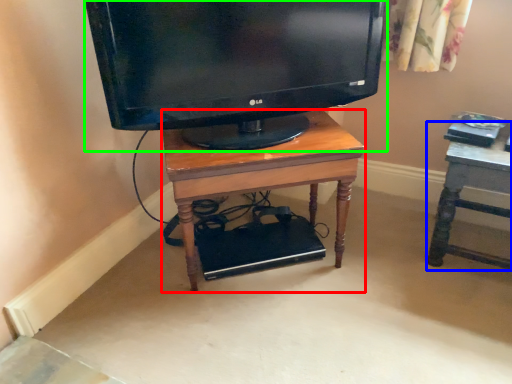
Question: Estimate the real-world distances between objects in this image. Which object is closer to desk (highlighted by a red box), furniture (highlighted by a blue box) or television (highlighted by a green box)?

Choices:
 (A) furniture
 (B) television

Answer: (B)